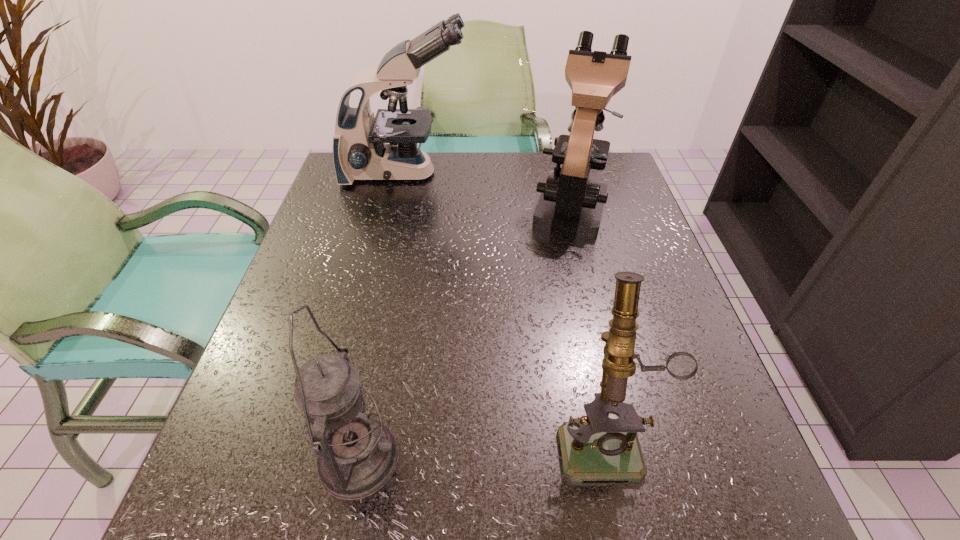
Locate an element on the screen. The height and width of the screenshot is (540, 960). object that is at the near left corner is located at coordinates (357, 455).

Identify the location of object located at the far right corner. The height and width of the screenshot is (540, 960). (571, 205).

In order to click on object at the near right corner in this screenshot , I will do `click(595, 447)`.

In the image, there is a desktop. Where is `free space at the far edge`? This screenshot has height=540, width=960. free space at the far edge is located at coordinates (489, 174).

In the image, there is a desktop. Identify the location of vacant space at the left edge. (344, 290).

This screenshot has width=960, height=540. In order to click on vacant space at the right edge of the desktop in this screenshot , I will do `click(650, 258)`.

Locate an element on the screen. vacant space at the far left corner of the desktop is located at coordinates (358, 191).

Locate an element on the screen. Image resolution: width=960 pixels, height=540 pixels. free space at the near left corner of the desktop is located at coordinates (204, 482).

Locate an element on the screen. free space between the leftmost microscope and the nearest microscope is located at coordinates (505, 303).

The width and height of the screenshot is (960, 540). I want to click on free space between the shortest microscope and the oil lamp, so click(x=481, y=446).